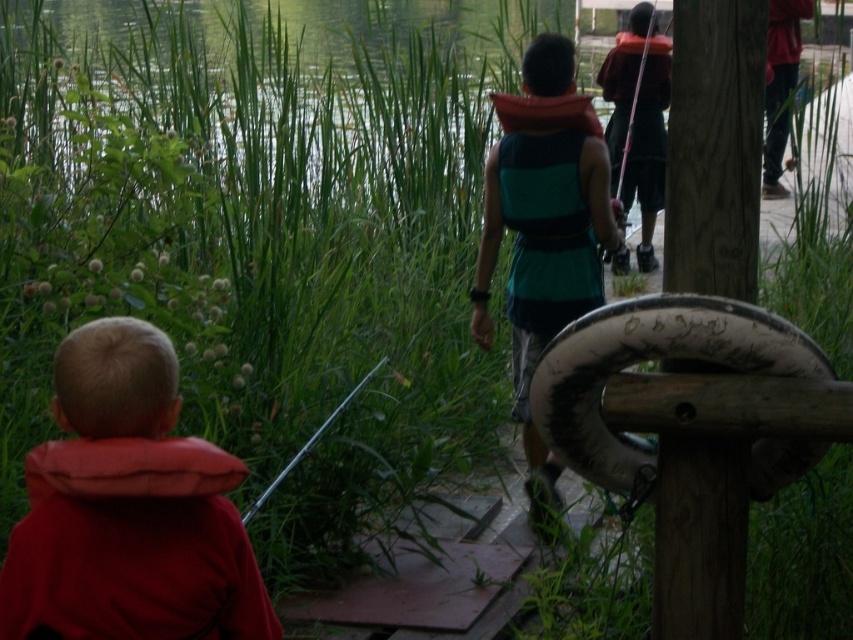
Question: Can you confirm if wooden post at right is bigger than metallic silver fishing pole at lower center?

Choices:
 (A) no
 (B) yes

Answer: (A)

Question: Which is farther from the teal fabric life vest at center?

Choices:
 (A) red soft vest at left
 (B) wooden post at right
 (C) metallic silver fishing pole at lower center

Answer: (A)

Question: Considering the real-world distances, which object is closest to the metallic silver fishing pole at lower center?

Choices:
 (A) wooden post at right
 (B) teal fabric life vest at center
 (C) red soft vest at left

Answer: (B)

Question: Does teal fabric life vest at center appear on the right side of metallic silver fishing pole at lower center?

Choices:
 (A) yes
 (B) no

Answer: (A)

Question: Is wooden post at right to the left of metallic silver fishing pole at lower center from the viewer's perspective?

Choices:
 (A) no
 (B) yes

Answer: (A)

Question: Based on their relative distances, which object is farther from the wooden post at right?

Choices:
 (A) metallic silver fishing pole at lower center
 (B) teal fabric life vest at center

Answer: (B)